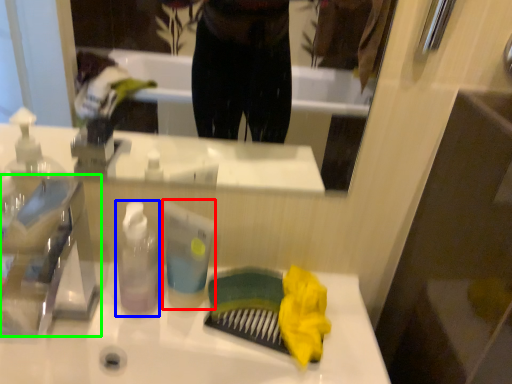
Question: Which object is the closest to the toiletry (highlighted by a red box)? Choose among these: bottle (highlighted by a blue box) or faucet (highlighted by a green box).

Choices:
 (A) bottle
 (B) faucet

Answer: (A)